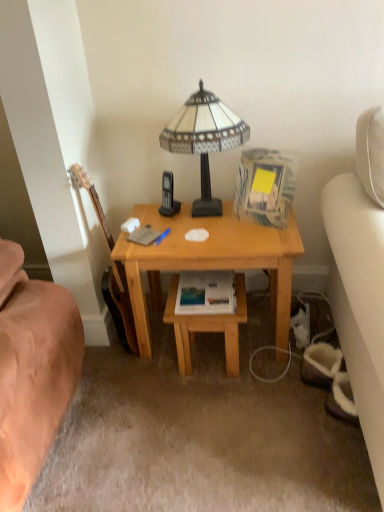
You are a GUI agent. You are given a task and a screenshot of the screen. Output one action in this format:
    pyautogui.click(x=<x>, y=<y>)
    Task: Click on the free space in front of wooden desk at center
    This screenshot has width=384, height=512.
    Given the screenshot: What is the action you would take?
    pyautogui.click(x=220, y=428)